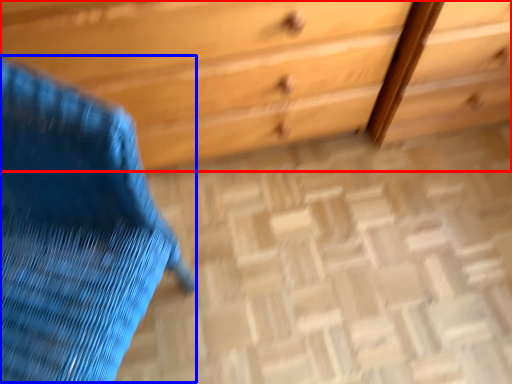
Question: Which of the following is the closest to the observer, chest of drawers (highlighted by a red box) or swivel chair (highlighted by a blue box)?

Choices:
 (A) chest of drawers
 (B) swivel chair

Answer: (B)